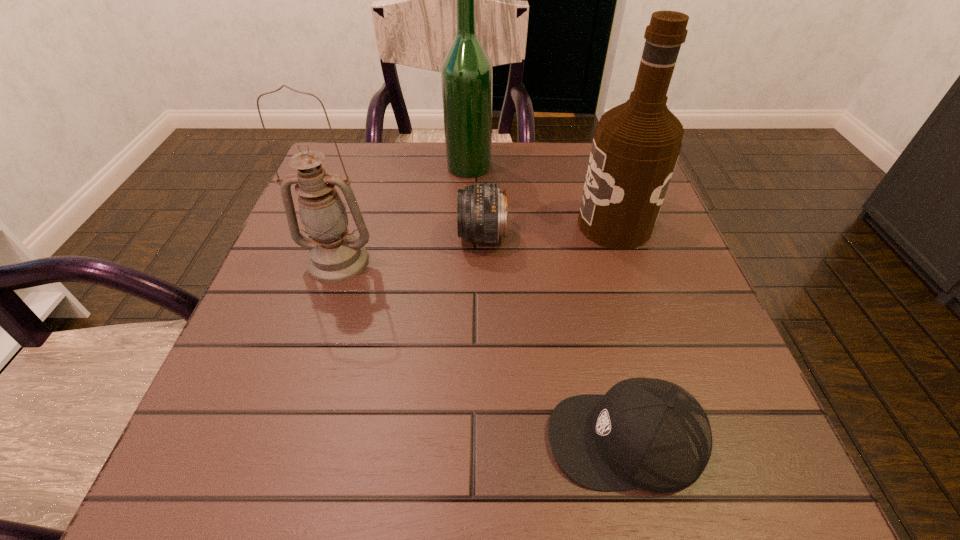
Find the location of a particular element. The image size is (960, 540). free spot located 0.220m on the label of the nearer alcohol is located at coordinates (476, 225).

Identify the location of free space located on the label of the nearer alcohol. The image size is (960, 540). (476, 225).

The width and height of the screenshot is (960, 540). Identify the location of free space located on the back of the leftmost object. (365, 179).

Find the location of a particular element. vacant space located at the front element of the second shortest object is located at coordinates (369, 237).

The width and height of the screenshot is (960, 540). Identify the location of free region located at the front element of the second shortest object. (316, 237).

Where is `vacant space situated 0.180m at the front element of the second shortest object`? vacant space situated 0.180m at the front element of the second shortest object is located at coordinates (373, 237).

Locate an element on the screen. vacant region located 0.150m on the front-facing side of the shortest object is located at coordinates [442, 438].

Where is `free space located on the front-facing side of the shortest object`? free space located on the front-facing side of the shortest object is located at coordinates (420, 438).

At what (x,y) coordinates should I click in order to perform the action: click on blank space located 0.100m on the front-facing side of the shortest object. Please return your answer as a coordinate pair (x, y). Looking at the image, I should click on (477, 438).

Where is `object located in the far edge section of the desktop`? The height and width of the screenshot is (540, 960). object located in the far edge section of the desktop is located at coordinates (467, 74).